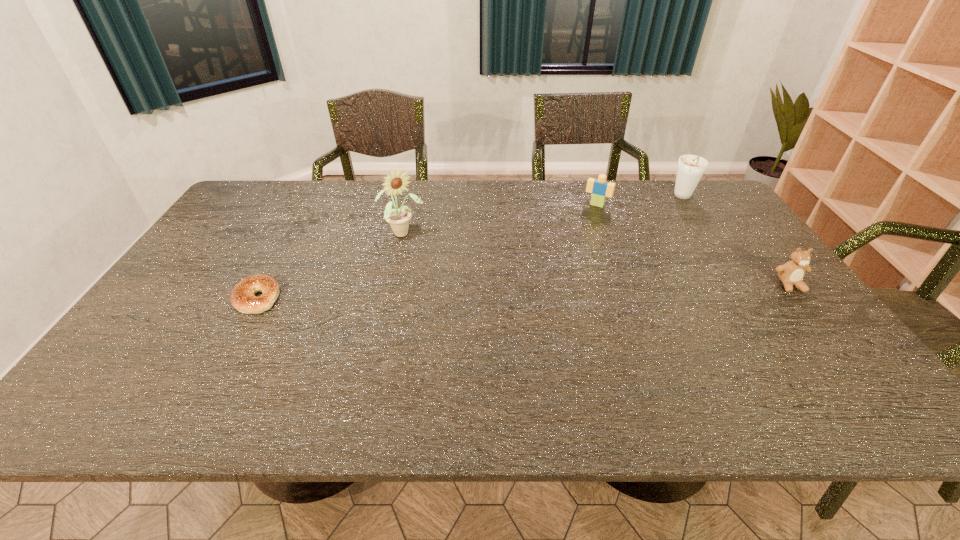
Where is `vacant space at the far right corner`? The height and width of the screenshot is (540, 960). vacant space at the far right corner is located at coordinates (700, 183).

Identify the location of vacant space in between the leftmost object and the fourth object from right to left. (329, 266).

Image resolution: width=960 pixels, height=540 pixels. Identify the location of free space between the shortest object and the teddy bear. (523, 292).

Where is `vacant area between the root beer and the sunflower`? vacant area between the root beer and the sunflower is located at coordinates (543, 215).

Where is `blank region between the rightmost object and the leftmost object`? The height and width of the screenshot is (540, 960). blank region between the rightmost object and the leftmost object is located at coordinates (523, 292).

Find the location of `vacant space that is in between the second tallest object and the bagel`. vacant space that is in between the second tallest object and the bagel is located at coordinates (470, 247).

The width and height of the screenshot is (960, 540). I want to click on unoccupied position between the root beer and the Lego, so click(x=640, y=201).

You are a GUI agent. You are given a task and a screenshot of the screen. Output one action in this format:
    pyautogui.click(x=<x>, y=<y>)
    Task: Click on the unoccupied area between the leftmost object and the second object from left to right
    
    Given the screenshot: What is the action you would take?
    (329, 266)

Identify the location of vacant region between the third object from right to left and the leftmost object. This screenshot has width=960, height=540. (427, 251).

Identify the location of free spot between the fourth shortest object and the third farthest object. The width and height of the screenshot is (960, 540). (543, 215).